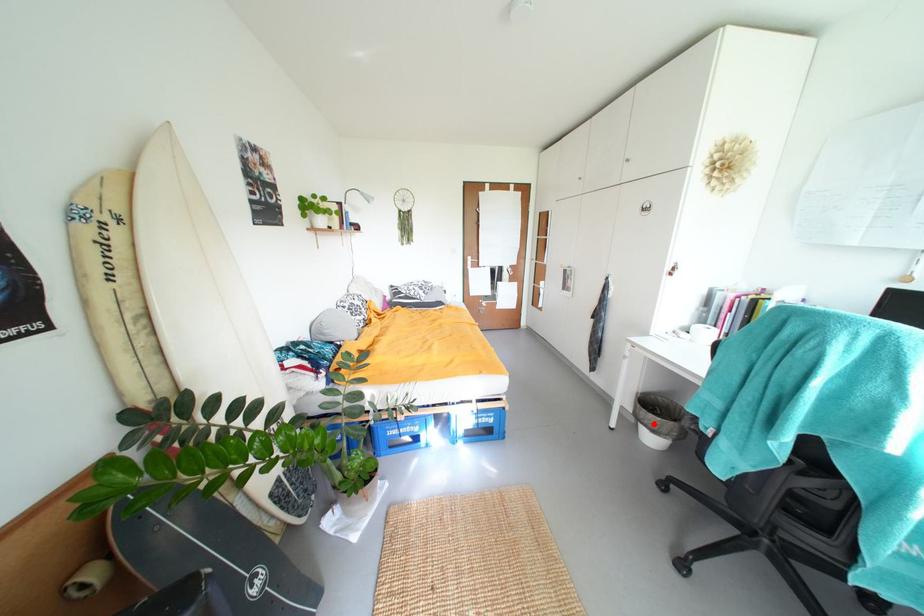
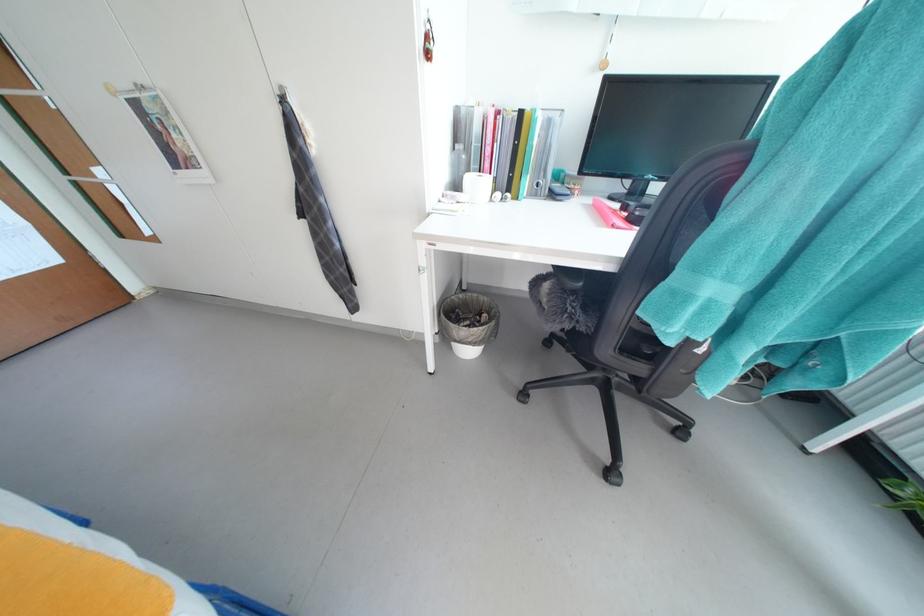
Where in the second image is the point corresponding to the highlighted location from the first image?

(478, 342)